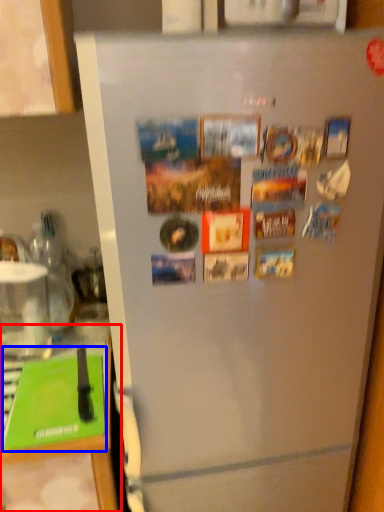
Question: Which of the following is the closest to the observer, counter top (highlighted by a red box) or magazine (highlighted by a blue box)?

Choices:
 (A) counter top
 (B) magazine

Answer: (A)